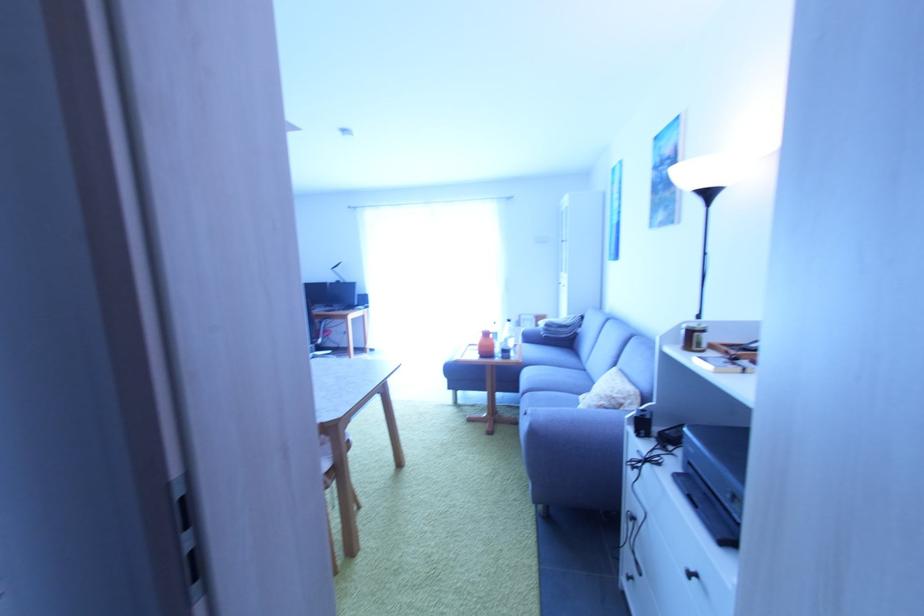
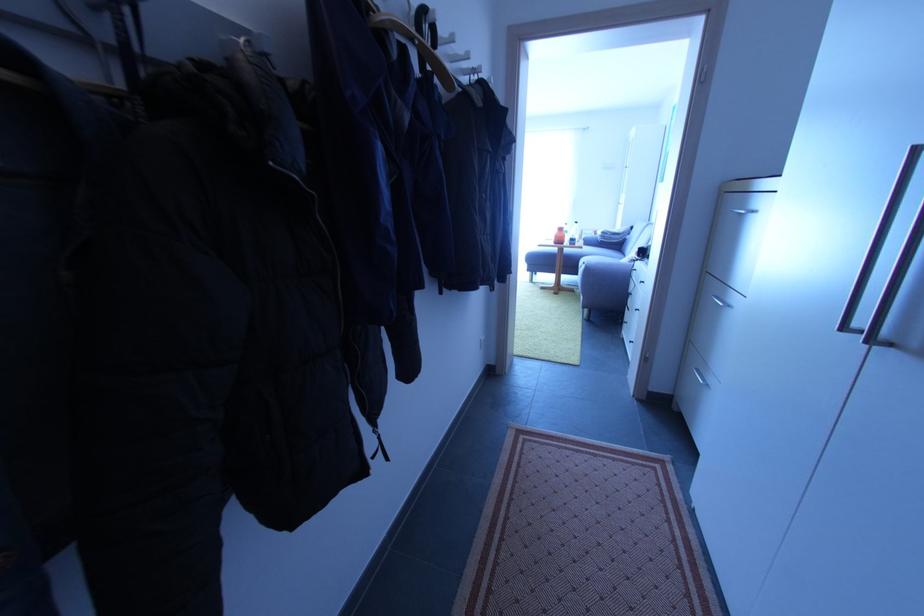
Find the pixel in the second image that matches the point at 524,326 in the first image.

(585, 238)